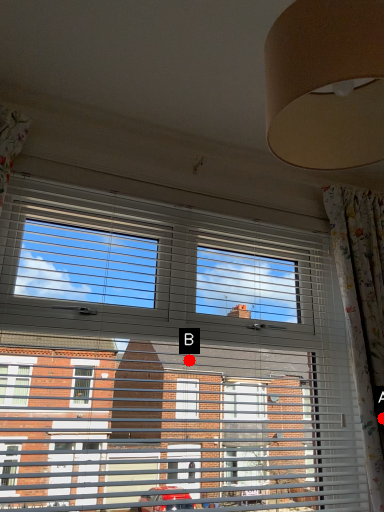
Question: Two points are circled on the image, labeled by A and B beside each circle. Which point is further to the camera?

Choices:
 (A) A is further
 (B) B is further

Answer: (A)